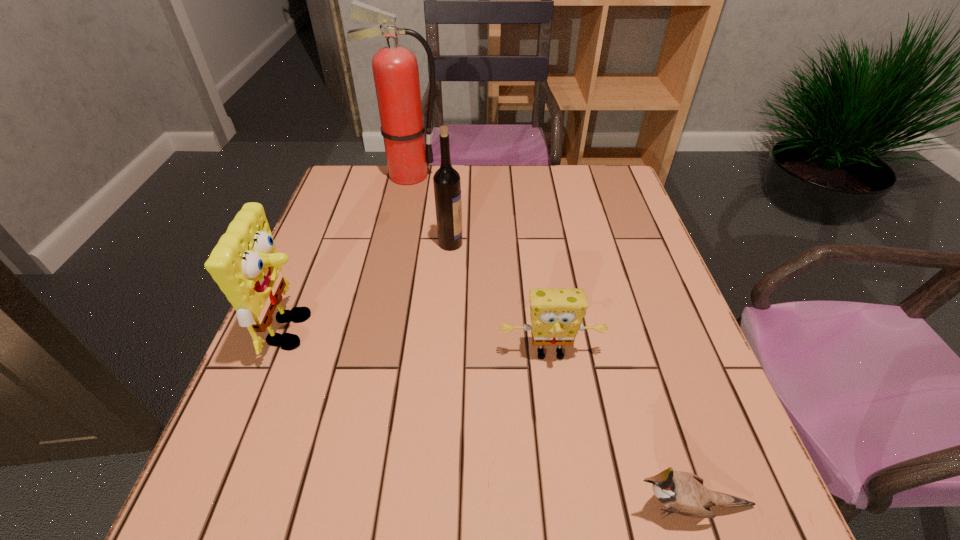
Image resolution: width=960 pixels, height=540 pixels. I want to click on free region located on the label of the wine bottle, so click(x=597, y=243).

In order to click on free spot located on the face of the taller sponge in this screenshot , I will do `click(377, 330)`.

Where is `vacant area situated on the face of the shorter sponge`? vacant area situated on the face of the shorter sponge is located at coordinates (564, 453).

Locate an element on the screen. The image size is (960, 540). free spot located 0.110m at the face of the nearest object is located at coordinates (558, 507).

Where is `vacant position located 0.160m at the face of the nearest object`? The height and width of the screenshot is (540, 960). vacant position located 0.160m at the face of the nearest object is located at coordinates (526, 507).

Locate an element on the screen. The width and height of the screenshot is (960, 540). vacant space located 0.380m at the face of the nearest object is located at coordinates (385, 507).

The width and height of the screenshot is (960, 540). I want to click on object that is at the far edge, so click(x=395, y=69).

The image size is (960, 540). What are the coordinates of `object located at the near edge` in the screenshot? It's located at (683, 493).

At what (x,y) coordinates should I click in order to perform the action: click on fire extinguisher that is positioned at the left edge. Please return your answer as a coordinate pair (x, y). Looking at the image, I should click on (395, 69).

Find the location of a particular element. The width and height of the screenshot is (960, 540). sponge that is positioned at the left edge is located at coordinates (245, 264).